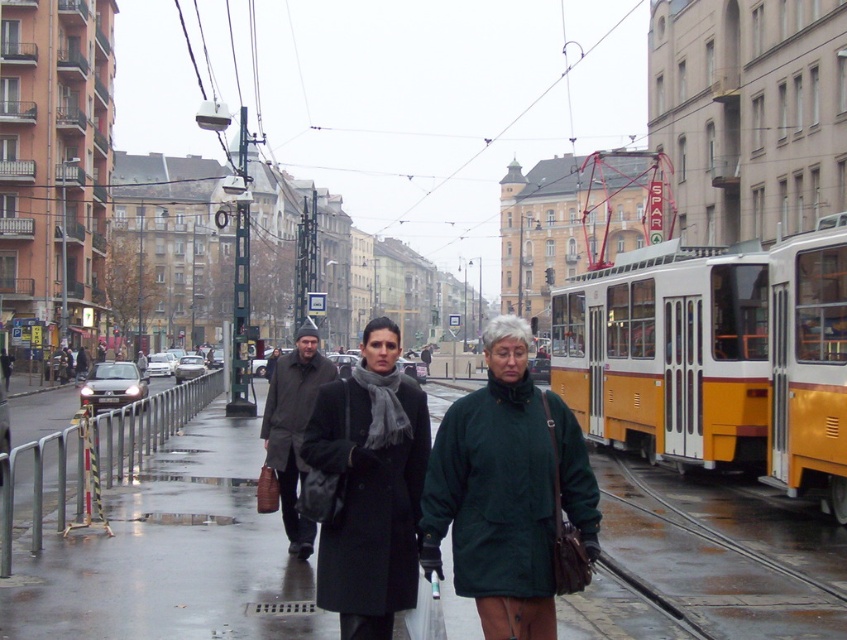
Is point (457, 484) less distant than point (424, 456)?

Yes.

Is point (524, 412) less distant than point (402, 468)?

Yes.

The width and height of the screenshot is (847, 640). What are the coordinates of `green matte coat at center` in the screenshot? It's located at (507, 492).

Which of these two, shiny asphalt pavement at center or dark brown leather coat at center, stands shorter?

With less height is shiny asphalt pavement at center.

Measure the distance between shiny asphalt pavement at center and camera.

shiny asphalt pavement at center is 6.31 meters away from camera.

Image resolution: width=847 pixels, height=640 pixels. I want to click on shiny asphalt pavement at center, so click(x=170, y=556).

Measure the distance from shiny asphalt pavement at center to green matte coat at center.

shiny asphalt pavement at center is 9.08 meters away from green matte coat at center.

Between point (208, 529) and point (558, 499), which one is positioned behind?

The point (208, 529) is more distant.

Identify the location of shiny asphalt pavement at center. (170, 556).